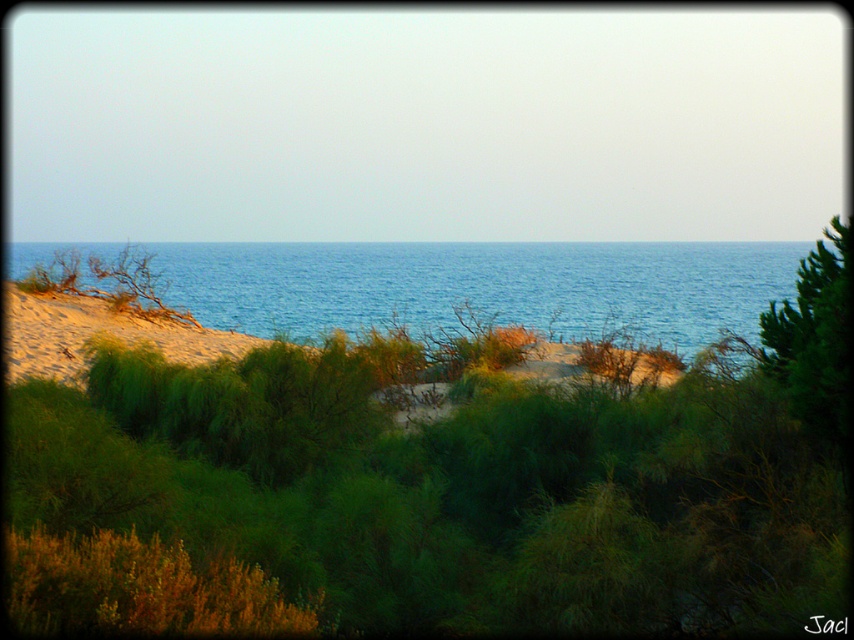
Question: Which point is farther to the camera?

Choices:
 (A) (423, 268)
 (B) (174, 323)

Answer: (A)

Question: Can you confirm if blue water at center is positioned below sandy beach at left?

Choices:
 (A) yes
 (B) no

Answer: (B)

Question: Observing the image, what is the correct spatial positioning of blue water at center in reference to sandy beach at left?

Choices:
 (A) right
 (B) left

Answer: (B)

Question: Among these points, which one is farthest from the camera?

Choices:
 (A) (267, 273)
 (B) (67, 376)

Answer: (A)

Question: Can you confirm if blue water at center is positioned to the right of sandy beach at left?

Choices:
 (A) no
 (B) yes

Answer: (A)